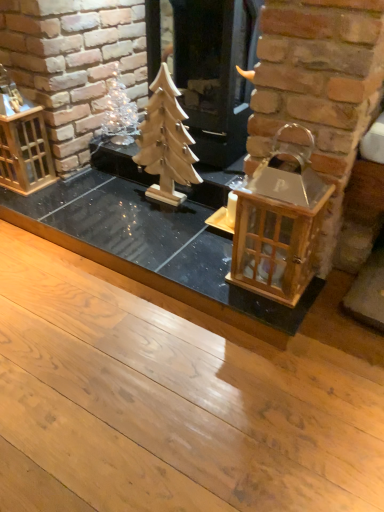
Where is `free point to the left of wooden christmas tree at center`? The width and height of the screenshot is (384, 512). free point to the left of wooden christmas tree at center is located at coordinates (116, 201).